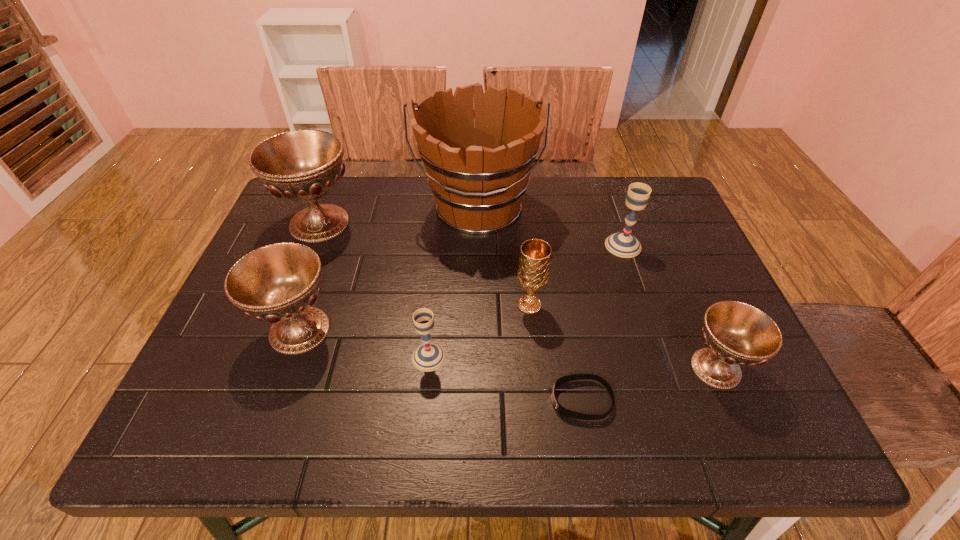
In order to click on vacant point located on the display of the shortest object in this screenshot , I will do point(505,400).

You are a GUI agent. You are given a task and a screenshot of the screen. Output one action in this format:
    pyautogui.click(x=<x>, y=<y>)
    Task: Click on the wine bucket present at the far edge
    
    Given the screenshot: What is the action you would take?
    pyautogui.click(x=478, y=185)

Identify the location of chalice located in the far edge section of the desktop. (303, 165).

Locate an element on the screen. object that is at the near edge is located at coordinates (563, 411).

Identify the location of object at the far left corner. (303, 165).

Locate an element on the screen. vacant space at the far edge of the desktop is located at coordinates (574, 218).

The height and width of the screenshot is (540, 960). In the image, there is a desktop. Find the location of `vacant space at the left edge`. vacant space at the left edge is located at coordinates tap(256, 376).

You are a GUI agent. You are given a task and a screenshot of the screen. Output one action in this format:
    pyautogui.click(x=<x>, y=<y>)
    Task: Click on the vacant position at the right edge of the desktop
    
    Given the screenshot: What is the action you would take?
    pyautogui.click(x=700, y=300)

The width and height of the screenshot is (960, 540). In order to click on vacant area at the near left corner in this screenshot , I will do `click(200, 406)`.

The width and height of the screenshot is (960, 540). In the image, there is a desktop. Find the location of `blank space at the far right corner`. blank space at the far right corner is located at coordinates (661, 191).